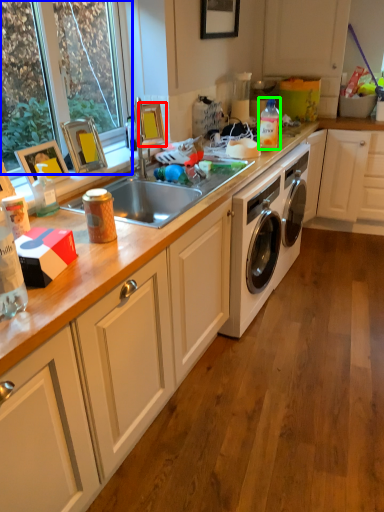
Question: Estimate the real-world distances between objects in this image. Which object is closer to picture frame (highlighted by a red box), window frame (highlighted by a blue box) or bottle (highlighted by a green box)?

Choices:
 (A) window frame
 (B) bottle

Answer: (A)